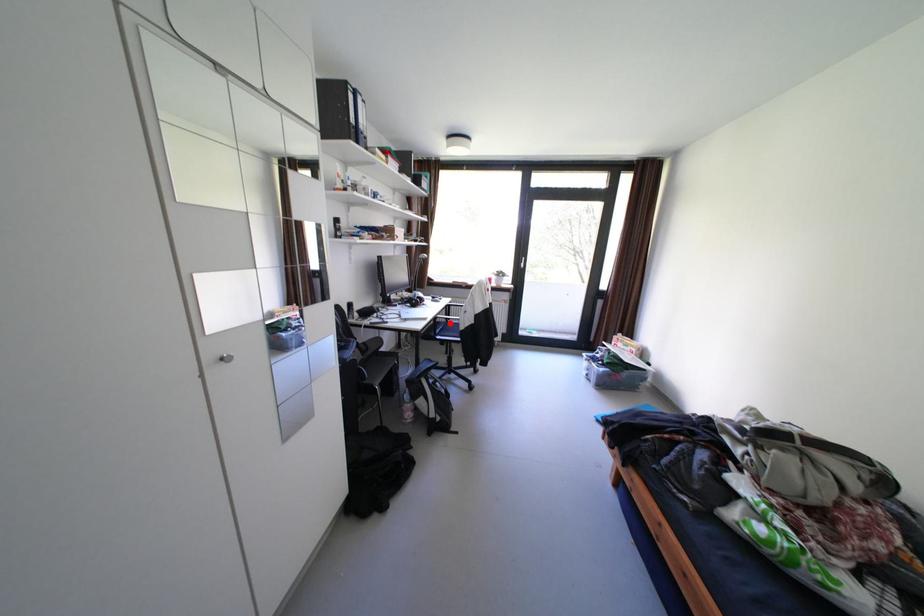
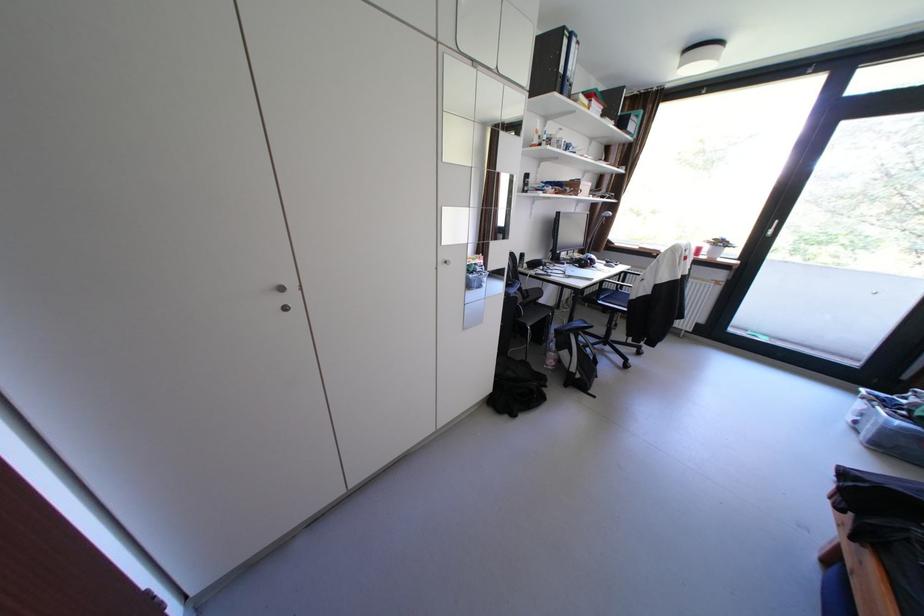
Question: I am providing you with two images of the same scene from different viewpoints. A red point is marked on the first image. Is the red point's position out of view in image 2?

Choices:
 (A) Yes
 (B) No

Answer: (B)